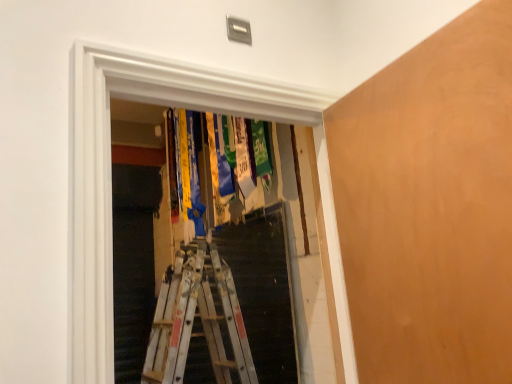
Question: Is the depth of smooth orange plywood at right greater than that of transparent plastic medals at center?

Choices:
 (A) no
 (B) yes

Answer: (A)

Question: Is smooth orange plywood at right to the left of transparent plastic medals at center from the viewer's perspective?

Choices:
 (A) no
 (B) yes

Answer: (A)

Question: Can we say smooth orange plywood at right lies outside transparent plastic medals at center?

Choices:
 (A) no
 (B) yes

Answer: (B)

Question: Considering the relative positions of smooth orange plywood at right and transparent plastic medals at center in the image provided, is smooth orange plywood at right to the right of transparent plastic medals at center from the viewer's perspective?

Choices:
 (A) yes
 (B) no

Answer: (A)

Question: Does smooth orange plywood at right have a larger size compared to transparent plastic medals at center?

Choices:
 (A) no
 (B) yes

Answer: (A)

Question: In terms of size, does transparent plastic medals at center appear bigger or smaller than metallic silver ladder at center?

Choices:
 (A) small
 (B) big

Answer: (B)

Question: Visually, is transparent plastic medals at center positioned to the left or to the right of metallic silver ladder at center?

Choices:
 (A) left
 (B) right

Answer: (B)

Question: In the image, is transparent plastic medals at center positioned in front of or behind metallic silver ladder at center?

Choices:
 (A) front
 (B) behind

Answer: (A)

Question: Is transparent plastic medals at center wider or thinner than metallic silver ladder at center?

Choices:
 (A) wide
 (B) thin

Answer: (A)

Question: Looking at their shapes, would you say metallic silver ladder at center is wider or thinner than smooth orange plywood at right?

Choices:
 (A) wide
 (B) thin

Answer: (B)

Question: From the image's perspective, is metallic silver ladder at center positioned above or below smooth orange plywood at right?

Choices:
 (A) below
 (B) above

Answer: (A)

Question: From a real-world perspective, relative to smooth orange plywood at right, is metallic silver ladder at center vertically above or below?

Choices:
 (A) above
 (B) below

Answer: (B)

Question: Is metallic silver ladder at center in front of or behind smooth orange plywood at right in the image?

Choices:
 (A) behind
 (B) front

Answer: (A)

Question: In the image, is transparent plastic medals at center positioned in front of or behind smooth orange plywood at right?

Choices:
 (A) front
 (B) behind

Answer: (B)

Question: From the image's perspective, is transparent plastic medals at center above or below smooth orange plywood at right?

Choices:
 (A) below
 (B) above

Answer: (A)